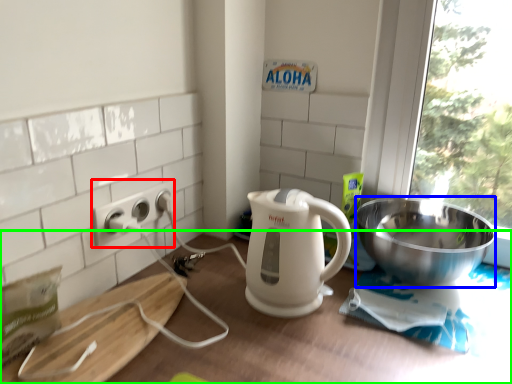
Question: Which is nearer to the power outlet (highlighted by a red box)? bowl (highlighted by a blue box) or table (highlighted by a green box).

Choices:
 (A) bowl
 (B) table

Answer: (B)